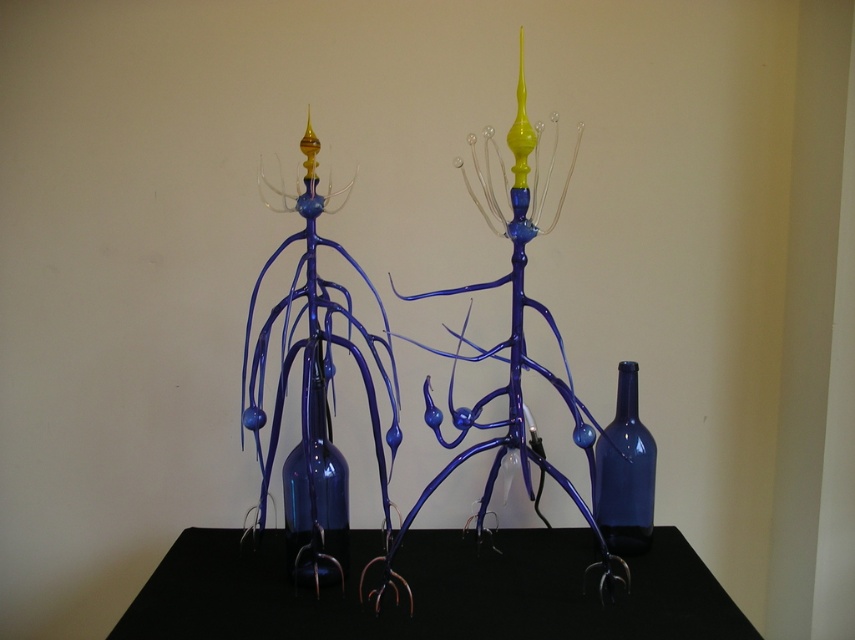
Question: Is transparent blue glass bottle at center thinner than transparent blue glass bottle at right?

Choices:
 (A) no
 (B) yes

Answer: (A)

Question: Which of the following is the closest to the observer?

Choices:
 (A) (429, 628)
 (B) (638, 474)
 (C) (319, 452)

Answer: (A)

Question: Which object is farther from the camera taking this photo?

Choices:
 (A) transparent blue glass bottle at right
 (B) transparent blue glass bottle at center
 (C) black matte table at center

Answer: (A)

Question: Is black matte table at center above transparent blue glass bottle at center?

Choices:
 (A) yes
 (B) no

Answer: (B)

Question: Which point appears closest to the camera in this image?

Choices:
 (A) pyautogui.click(x=503, y=532)
 (B) pyautogui.click(x=603, y=500)

Answer: (B)

Question: Does transparent blue glass bottle at center have a lesser width compared to transparent blue glass bottle at right?

Choices:
 (A) yes
 (B) no

Answer: (B)